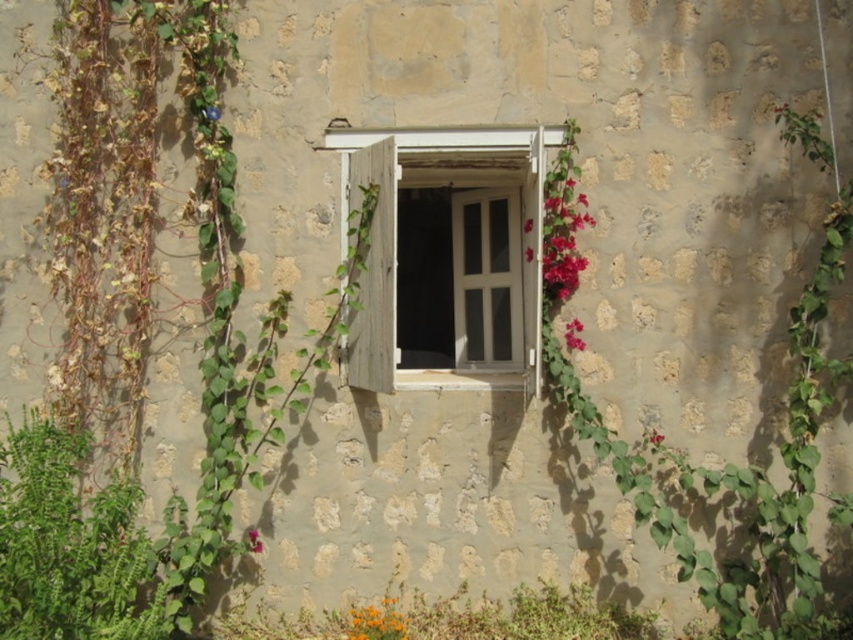
Is green leafy vine at right thinner than pink matte flower at right?

No, green leafy vine at right is not thinner than pink matte flower at right.

Can you confirm if green leafy vine at right is positioned above pink matte flower at right?

Actually, green leafy vine at right is below pink matte flower at right.

Who is more forward, (572, 406) or (576, 346)?

Point (572, 406)

At what (x,y) coordinates should I click in order to perform the action: click on green leafy vine at right. Please return your answer as a coordinate pair (x, y). The height and width of the screenshot is (640, 853). Looking at the image, I should click on tap(735, 472).

Can you confirm if white wooden window at center is shorter than pink matte flower at lower center?

In fact, white wooden window at center may be taller than pink matte flower at lower center.

Which is above, white wooden window at center or pink matte flower at lower center?

white wooden window at center is higher up.

Based on the photo, who is more forward, (442,296) or (248,532)?

Point (248,532) is more forward.

At what (x,y) coordinates should I click in order to perform the action: click on white wooden window at center. Please return your answer as a coordinate pair (x, y). This screenshot has width=853, height=640. Looking at the image, I should click on (450, 253).

Does point (822, 369) come farther from viewer compared to point (258, 548)?

That is False.

Based on the photo, who is more distant from viewer, (817, 410) or (252, 531)?

Point (252, 531)

Locate an element on the screen. green leafy vine at right is located at coordinates (735, 472).